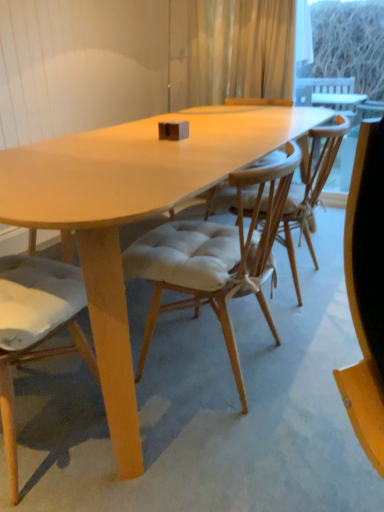
Question: Is transparent glass window screen at upper right directly adjacent to translucent fabric curtain at upper center?

Choices:
 (A) yes
 (B) no

Answer: (B)

Question: Could translucent fabric curtain at upper center be considered to be inside transparent glass window screen at upper right?

Choices:
 (A) yes
 (B) no

Answer: (B)

Question: Is transparent glass window screen at upper right shorter than translucent fabric curtain at upper center?

Choices:
 (A) yes
 (B) no

Answer: (B)

Question: Can you confirm if transparent glass window screen at upper right is positioned to the left of translucent fabric curtain at upper center?

Choices:
 (A) no
 (B) yes

Answer: (A)

Question: Considering the relative sizes of transparent glass window screen at upper right and translucent fabric curtain at upper center in the image provided, is transparent glass window screen at upper right wider than translucent fabric curtain at upper center?

Choices:
 (A) no
 (B) yes

Answer: (A)

Question: From the image's perspective, is light beige fabric chair at center, the 1th chair when ordered from right to left, above or below translucent fabric curtain at upper center?

Choices:
 (A) below
 (B) above

Answer: (A)

Question: Considering the positions of light beige fabric chair at center, which is the second chair in left-to-right order, and translucent fabric curtain at upper center in the image, is light beige fabric chair at center, which is the second chair in left-to-right order, bigger or smaller than translucent fabric curtain at upper center?

Choices:
 (A) small
 (B) big

Answer: (B)

Question: Relative to translucent fabric curtain at upper center, is light beige fabric chair at center, which is the second chair in left-to-right order, in front or behind?

Choices:
 (A) front
 (B) behind

Answer: (A)

Question: Visually, is light beige fabric chair at center, which is the second chair in left-to-right order, positioned to the left or to the right of translucent fabric curtain at upper center?

Choices:
 (A) right
 (B) left

Answer: (B)

Question: In terms of size, does translucent fabric curtain at upper center appear bigger or smaller than light brown wood chair at center, the 1th chair viewed from the left?

Choices:
 (A) small
 (B) big

Answer: (A)

Question: Which is correct: translucent fabric curtain at upper center is inside light brown wood chair at center, the 2th chair viewed from the right, or outside of it?

Choices:
 (A) outside
 (B) inside

Answer: (A)

Question: Considering their positions, is translucent fabric curtain at upper center located in front of or behind light brown wood chair at center, the 1th chair viewed from the left?

Choices:
 (A) front
 (B) behind

Answer: (B)

Question: In terms of width, does translucent fabric curtain at upper center look wider or thinner when compared to light brown wood chair at center, the 2th chair viewed from the right?

Choices:
 (A) thin
 (B) wide

Answer: (A)

Question: From the image's perspective, is translucent fabric curtain at upper center above or below light beige fabric chair at center, the 1th chair when ordered from right to left?

Choices:
 (A) below
 (B) above

Answer: (B)

Question: Would you say translucent fabric curtain at upper center is to the left or to the right of light beige fabric chair at center, which is the second chair in left-to-right order, in the picture?

Choices:
 (A) right
 (B) left

Answer: (A)